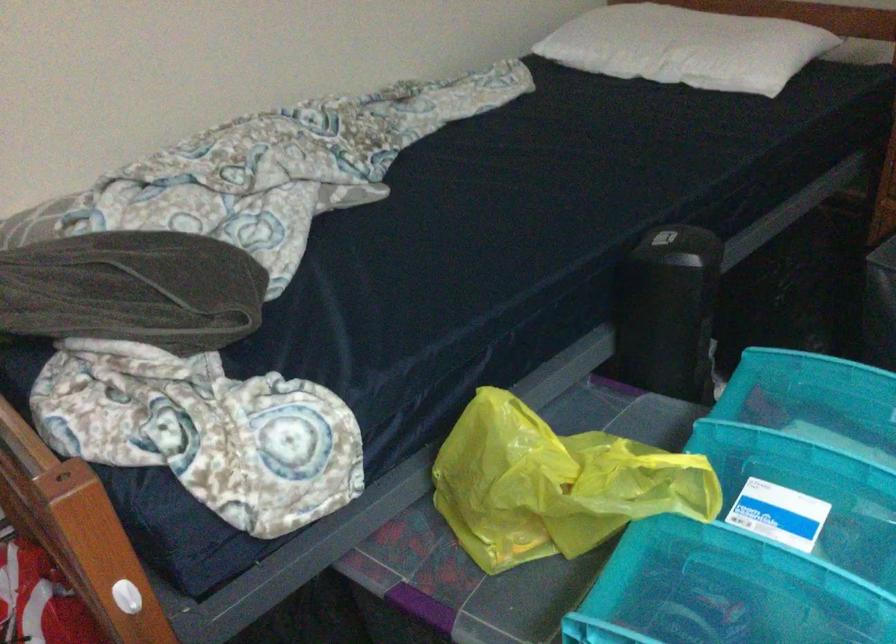
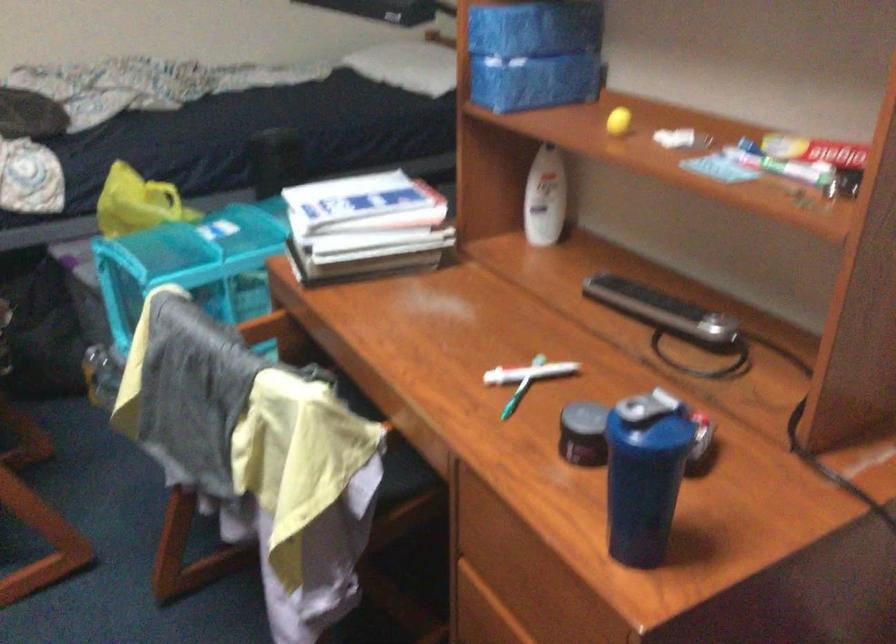
Where in the second image is the point corresponding to pixel 812 565 from the first image?

(205, 239)